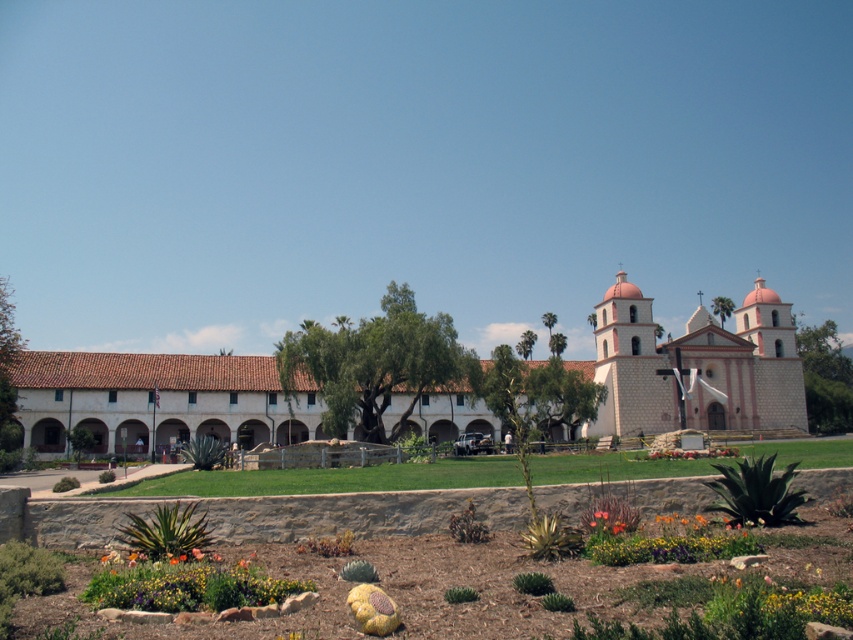
You are standing at the point labeled point (479, 580) in the garden area of the historic building scene. What type of surface are you currently standing on?

The point (479, 580) is on a multicolored mulch bed at lower center, so you are standing on a multicolored mulch bed.

You are a gardener looking at the image and want to plant a new flower in the garden. You see the multicolored mulch bed at lower center and the multicolored fabric flower at lower center. Which object is covering the other one?

The multicolored mulch bed at lower center is positioned over the multicolored fabric flower at lower center, so the mulch bed is covering the fabric flower.